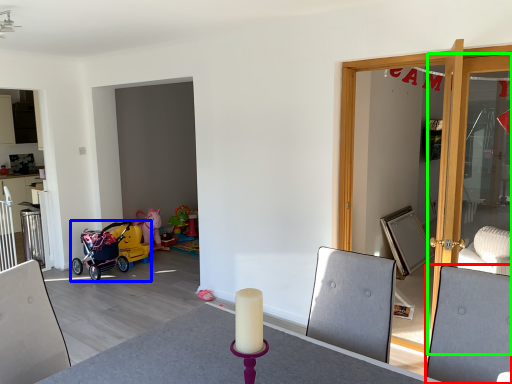
Question: Which is nearer to the swivel chair (highlighted by a red box)? stroller (highlighted by a blue box) or door (highlighted by a green box).

Choices:
 (A) stroller
 (B) door

Answer: (B)